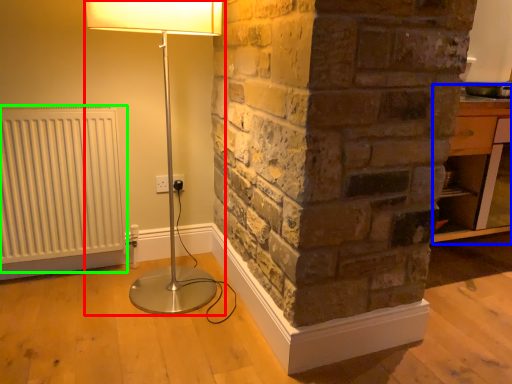
Question: Considering the real-world distances, which object is farthest from lamp (highlighted by a red box)? table (highlighted by a blue box) or radiator (highlighted by a green box)?

Choices:
 (A) table
 (B) radiator

Answer: (A)